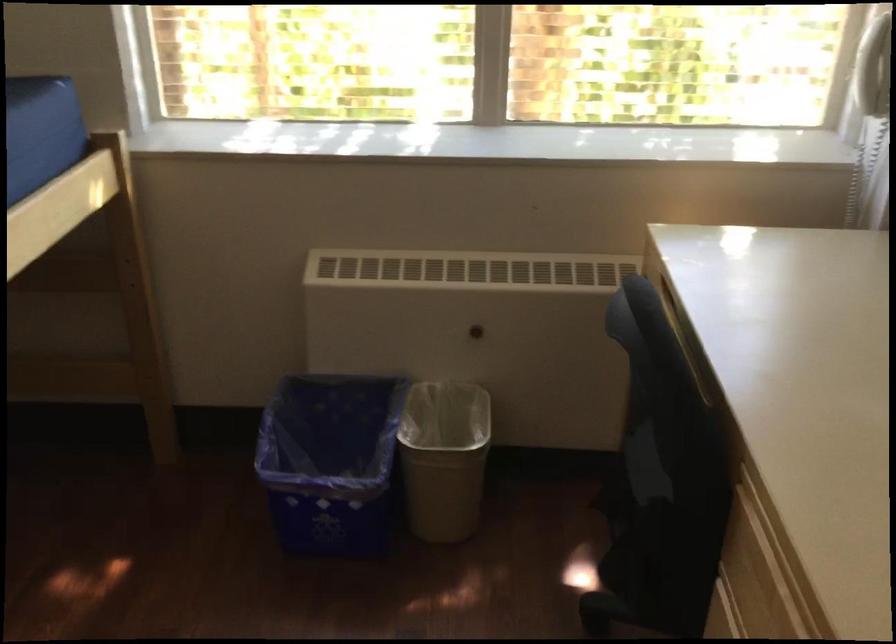
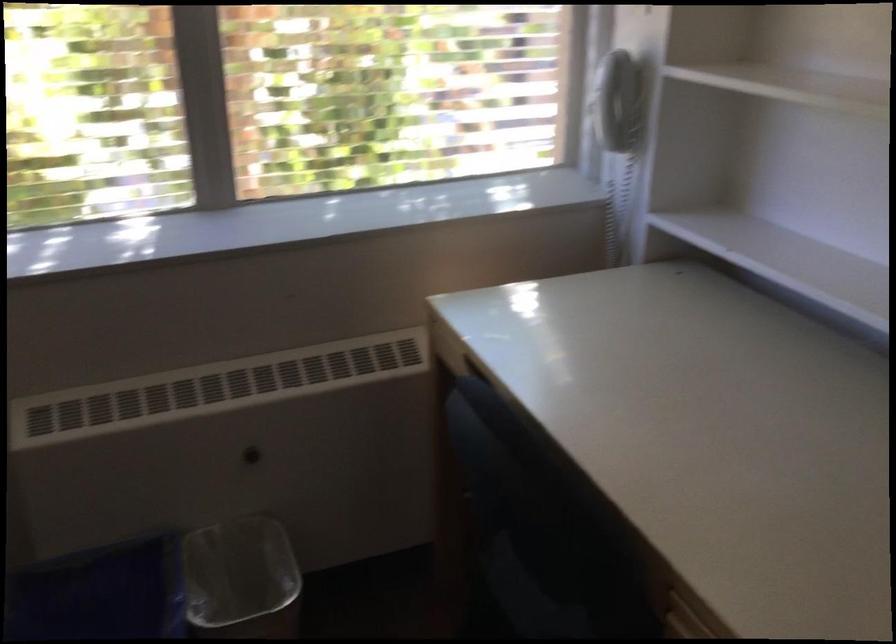
Based on the photo, in a continuous first-person perspective shot, in which direction is the camera moving?

The movement direction of the cameraman is left, forward.